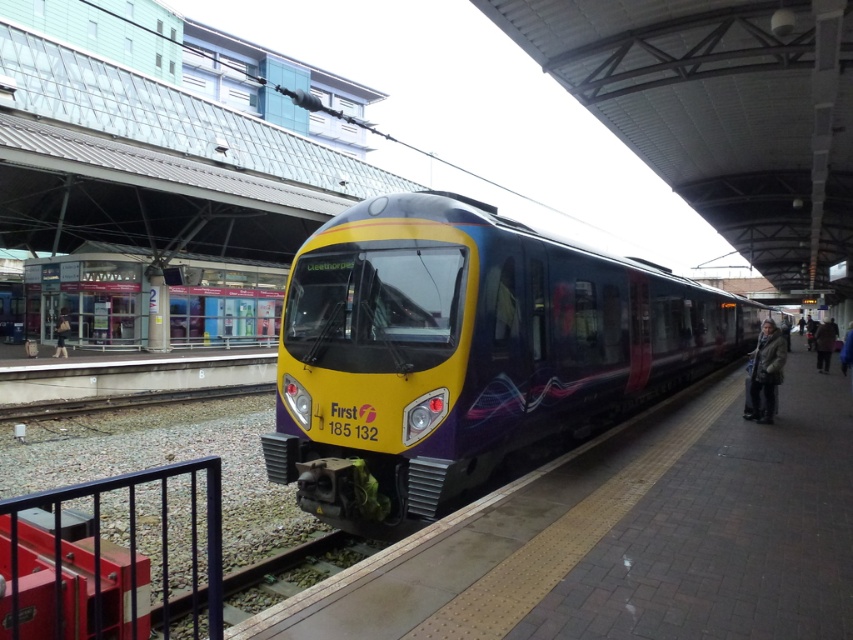
Question: Which of the following is the farthest from the observer?

Choices:
 (A) brown woolen coat at right
 (B) yellow matte train at center
 (C) dark brown leather jacket at right
 (D) dark gray jacket at left

Answer: (B)

Question: Does yellow matte train at center appear on the right side of dark brown leather jacket at right?

Choices:
 (A) no
 (B) yes

Answer: (A)

Question: Which of the following is the farthest from the observer?

Choices:
 (A) (776, 352)
 (B) (827, 362)
 (C) (451, 292)
 (D) (193, 276)

Answer: (D)

Question: Can you confirm if yellow/purple glossy train at center is positioned to the left of yellow matte train at center?

Choices:
 (A) yes
 (B) no

Answer: (B)

Question: Is the position of yellow/purple glossy train at center more distant than that of blue fabric jacket at right?

Choices:
 (A) yes
 (B) no

Answer: (B)

Question: Estimate the real-world distances between objects in this image. Which object is farther from the yellow/purple glossy train at center?

Choices:
 (A) dark brown leather jacket at right
 (B) blue fabric jacket at right

Answer: (A)